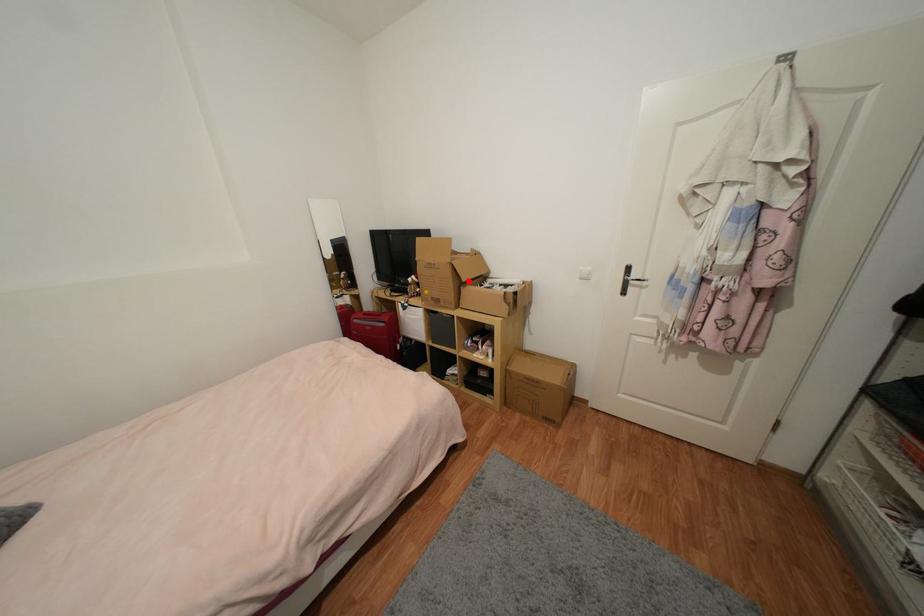
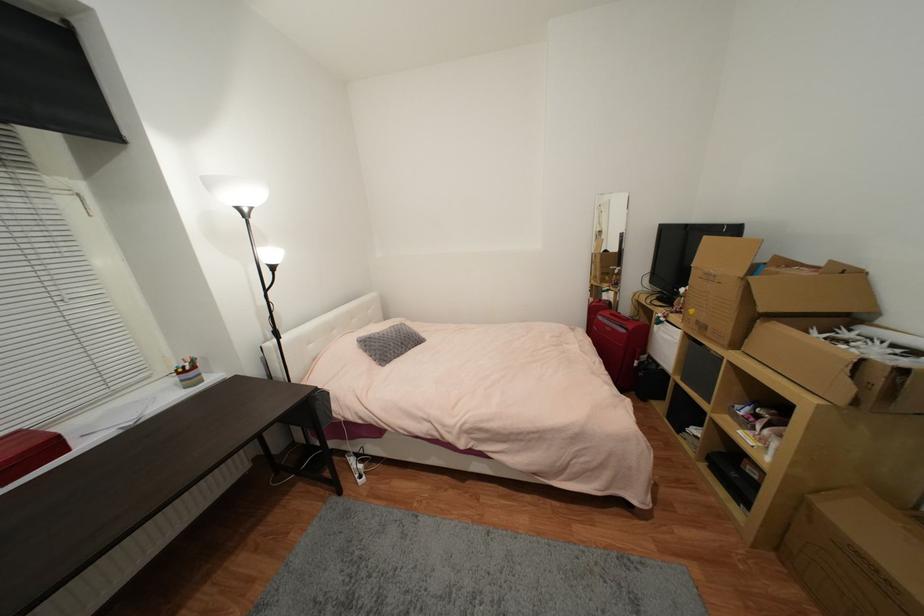
Question: I am providing you with two images of the same scene from different viewpoints. A red point is shown in image1. For the corresponding object point in image2, is it positioned nearer or farther from the camera?

Choices:
 (A) Nearer
 (B) Farther

Answer: (B)